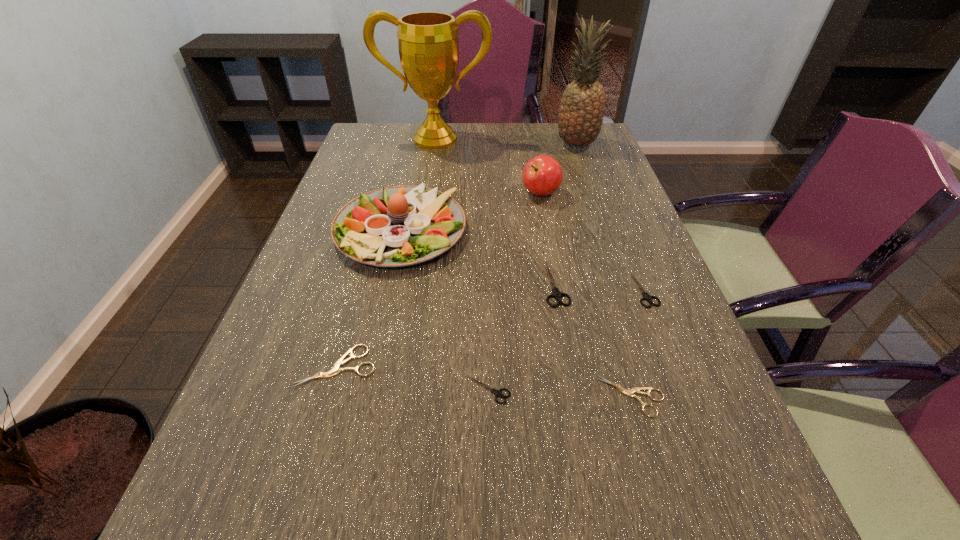
You are a GUI agent. You are given a task and a screenshot of the screen. Output one action in this format:
    pyautogui.click(x=<x>, y=<y>)
    Task: Click on the vacant area that lies between the gold award and the second biggest black shears
    The height and width of the screenshot is (540, 960).
    Given the screenshot: What is the action you would take?
    pyautogui.click(x=540, y=214)

Image resolution: width=960 pixels, height=540 pixels. In order to click on object that is the eighth closest to the right beige shears in this screenshot , I will do pyautogui.click(x=428, y=44).

Identify the location of object that is the closest to the pineapple. This screenshot has width=960, height=540. (542, 175).

The width and height of the screenshot is (960, 540). I want to click on shears object that ranks as the third closest to the pineapple, so click(630, 392).

Identify which shears is the second nearest to the left beige shears. Please provide its 2D coordinates. Your answer should be formatted as a tuple, i.e. [(x, y)], where the tuple contains the x and y coordinates of a point satisfying the conditions above.

[(556, 293)]

Where is `black shears that is the closest to the second biggest black shears`? black shears that is the closest to the second biggest black shears is located at coordinates (556, 293).

The image size is (960, 540). In order to click on black shears identified as the closest to the gold award in this screenshot , I will do `click(556, 293)`.

Image resolution: width=960 pixels, height=540 pixels. Identify the location of the second closest beige shears to the third shears from left to right. (336, 369).

This screenshot has width=960, height=540. What are the coordinates of `free location that satisfies the following two spatial constraints: 1. on the back side of the right beige shears; 2. on the left side of the pineapple` in the screenshot? It's located at (560, 145).

The image size is (960, 540). In order to click on free location that satisfies the following two spatial constraints: 1. on the back side of the left beige shears; 2. on the left side of the salad plate in this screenshot , I will do `click(375, 231)`.